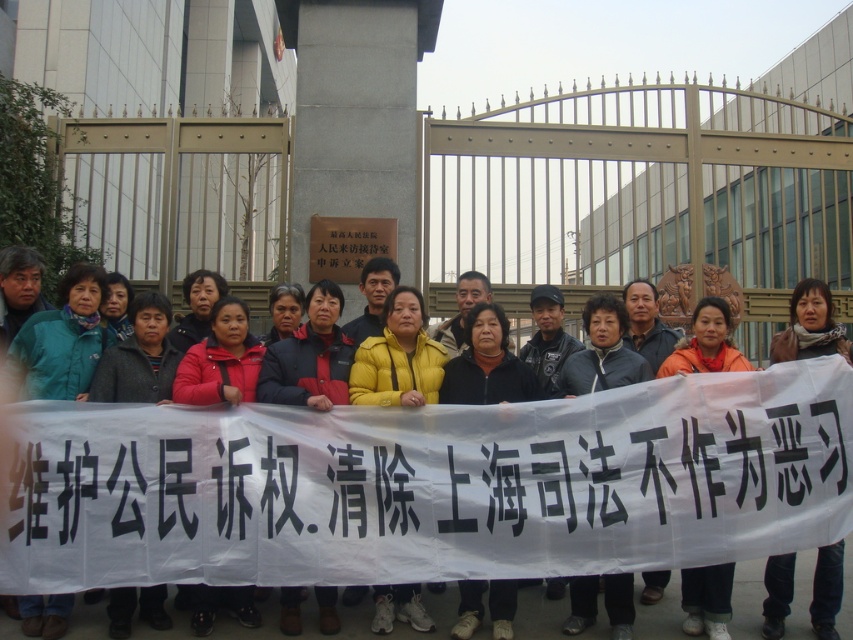
Which of these two, yellow fabric jacket at center or black paper banner at center, stands shorter?

Standing shorter between the two is yellow fabric jacket at center.

Which is behind, point (657, 456) or point (831, 509)?

Point (831, 509)

The width and height of the screenshot is (853, 640). I want to click on yellow fabric jacket at center, so click(x=430, y=484).